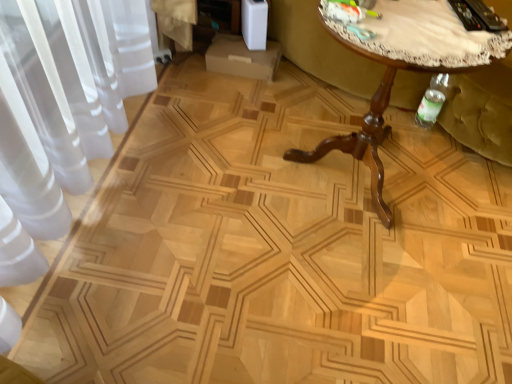
Question: From the image's perspective, is brown wooden table at center on green fabric swivel chair at right?

Choices:
 (A) yes
 (B) no

Answer: (B)

Question: From a real-world perspective, is brown wooden table at center positioned under green fabric swivel chair at right based on gravity?

Choices:
 (A) yes
 (B) no

Answer: (B)

Question: Does brown wooden table at center appear on the left side of green fabric swivel chair at right?

Choices:
 (A) no
 (B) yes

Answer: (B)

Question: From the image's perspective, is brown wooden table at center under green fabric swivel chair at right?

Choices:
 (A) no
 (B) yes

Answer: (B)

Question: Is brown wooden table at center not close to green fabric swivel chair at right?

Choices:
 (A) no
 (B) yes

Answer: (A)

Question: Can you confirm if brown wooden table at center is taller than green fabric swivel chair at right?

Choices:
 (A) no
 (B) yes

Answer: (B)

Question: Is the position of green fabric swivel chair at right more distant than that of brown wooden table at center?

Choices:
 (A) no
 (B) yes

Answer: (B)

Question: Is green fabric swivel chair at right outside of brown wooden table at center?

Choices:
 (A) yes
 (B) no

Answer: (A)

Question: Is green fabric swivel chair at right beside brown wooden table at center?

Choices:
 (A) yes
 (B) no

Answer: (B)

Question: Does green fabric swivel chair at right have a greater width compared to brown wooden table at center?

Choices:
 (A) no
 (B) yes

Answer: (B)

Question: Can you confirm if green fabric swivel chair at right is shorter than brown wooden table at center?

Choices:
 (A) yes
 (B) no

Answer: (A)

Question: Does green fabric swivel chair at right appear on the right side of brown wooden table at center?

Choices:
 (A) no
 (B) yes

Answer: (B)

Question: Relative to brown wooden table at center, is green fabric swivel chair at right in front or behind?

Choices:
 (A) behind
 (B) front

Answer: (A)